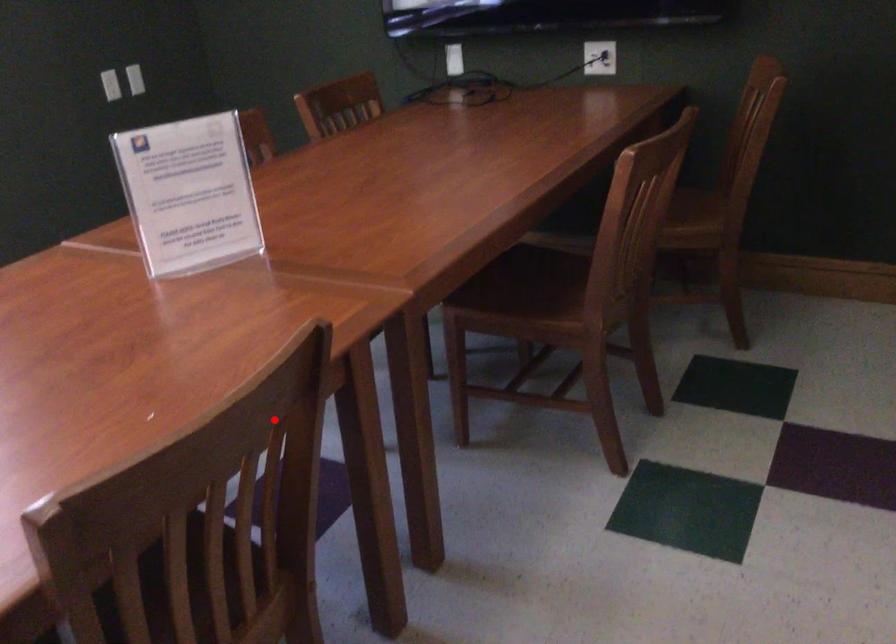
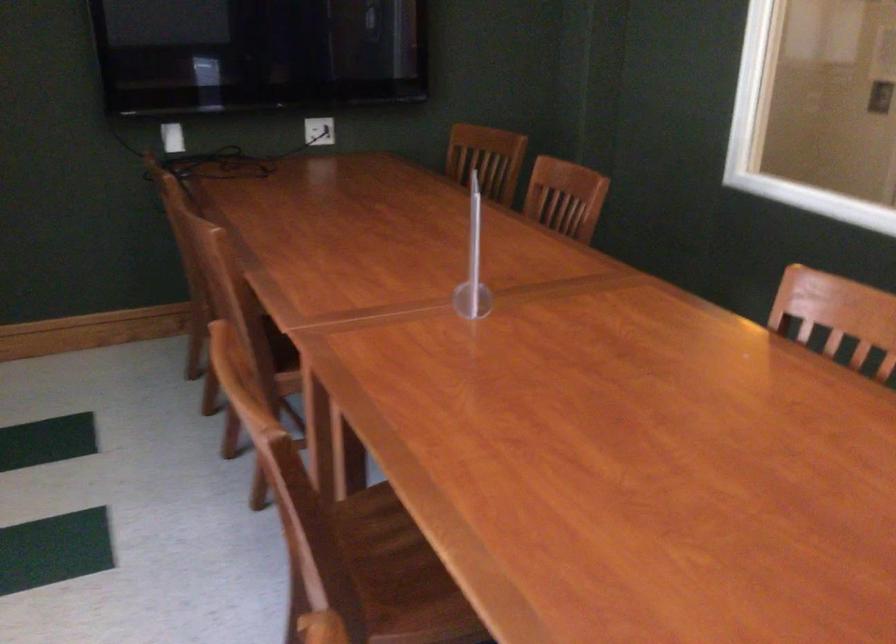
Find the pixel in the second image that matches the highlighted location in the first image.

(841, 313)